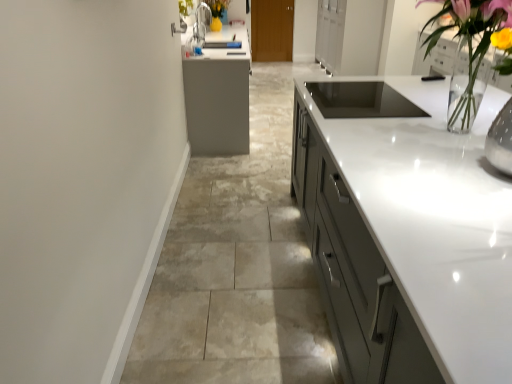
Question: Which direction should I rotate to look at brown wood door at center, the 1th cabinetry positioned from the back?

Choices:
 (A) left
 (B) right

Answer: (B)

Question: Is clear glass vase at upper right inside brown wood door at center, which is the 2th cabinetry in bottom-to-top order?

Choices:
 (A) no
 (B) yes

Answer: (A)

Question: Is brown wood door at center, positioned as the first cabinetry in top-to-bottom order, not within clear glass vase at upper right?

Choices:
 (A) no
 (B) yes

Answer: (B)

Question: From a real-world perspective, is brown wood door at center, which appears as the 2th cabinetry when viewed from the front, physically below clear glass vase at upper right?

Choices:
 (A) yes
 (B) no

Answer: (A)

Question: Considering the relative sizes of brown wood door at center, positioned as the first cabinetry in top-to-bottom order, and clear glass vase at upper right in the image provided, is brown wood door at center, positioned as the first cabinetry in top-to-bottom order, thinner than clear glass vase at upper right?

Choices:
 (A) no
 (B) yes

Answer: (B)

Question: Can you confirm if brown wood door at center, which is the 2th cabinetry in bottom-to-top order, is shorter than clear glass vase at upper right?

Choices:
 (A) yes
 (B) no

Answer: (B)

Question: Is brown wood door at center, which is the 2th cabinetry in bottom-to-top order, bigger than clear glass vase at upper right?

Choices:
 (A) yes
 (B) no

Answer: (B)

Question: From the image's perspective, is matte gray cabinetry at center, marked as the second cabinetry in a back-to-front arrangement, under clear glass vase at upper right?

Choices:
 (A) no
 (B) yes

Answer: (A)

Question: Is clear glass vase at upper right inside matte gray cabinetry at center, marked as the second cabinetry in a back-to-front arrangement?

Choices:
 (A) no
 (B) yes

Answer: (A)

Question: Is matte gray cabinetry at center, acting as the first cabinetry starting from the front, placed right next to clear glass vase at upper right?

Choices:
 (A) yes
 (B) no

Answer: (B)

Question: Does matte gray cabinetry at center, which appears as the 2th cabinetry when viewed from the top, have a larger size compared to clear glass vase at upper right?

Choices:
 (A) yes
 (B) no

Answer: (A)

Question: Is matte gray cabinetry at center, acting as the first cabinetry starting from the front, positioned with its back to clear glass vase at upper right?

Choices:
 (A) yes
 (B) no

Answer: (B)

Question: From a real-world perspective, is matte gray cabinetry at center, which appears as the 2th cabinetry when viewed from the top, on top of clear glass vase at upper right?

Choices:
 (A) no
 (B) yes

Answer: (A)

Question: Is clear glass vase at upper right to the left of matte gray cabinetry at center, which appears as the 2th cabinetry when viewed from the top, from the viewer's perspective?

Choices:
 (A) no
 (B) yes

Answer: (B)